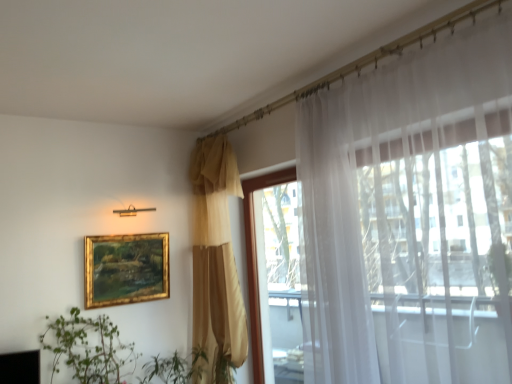
Question: Does matte gold curtain at center, arranged as the second curtain when viewed from the right, have a greater width compared to gold-framed painting at upper left?

Choices:
 (A) no
 (B) yes

Answer: (B)

Question: Is matte gold curtain at center, which is the 1th curtain in back-to-front order, facing away from gold-framed painting at upper left?

Choices:
 (A) yes
 (B) no

Answer: (B)

Question: Does matte gold curtain at center, which is the 2th curtain from front to back, have a lesser width compared to gold-framed painting at upper left?

Choices:
 (A) yes
 (B) no

Answer: (B)

Question: Is matte gold curtain at center, marked as the first curtain in a left-to-right arrangement, behind gold-framed painting at upper left?

Choices:
 (A) yes
 (B) no

Answer: (B)

Question: From a real-world perspective, is matte gold curtain at center, marked as the first curtain in a left-to-right arrangement, on gold-framed painting at upper left?

Choices:
 (A) no
 (B) yes

Answer: (B)

Question: Is white sheer curtain at right, which appears as the 2th curtain when viewed from the back, wider or thinner than green leafy plant at lower left?

Choices:
 (A) thin
 (B) wide

Answer: (A)

Question: From the image's perspective, is white sheer curtain at right, the 1th curtain from the front, above or below green leafy plant at lower left?

Choices:
 (A) above
 (B) below

Answer: (A)

Question: Visually, is white sheer curtain at right, which ranks as the first curtain in right-to-left order, positioned to the left or to the right of green leafy plant at lower left?

Choices:
 (A) right
 (B) left

Answer: (A)

Question: From their relative heights in the image, would you say white sheer curtain at right, which appears as the 2th curtain when viewed from the back, is taller or shorter than green leafy plant at lower left?

Choices:
 (A) tall
 (B) short

Answer: (A)

Question: Would you say transparent glass window at upper right is to the left or to the right of gold-framed painting at upper left in the picture?

Choices:
 (A) right
 (B) left

Answer: (A)

Question: In terms of height, does transparent glass window at upper right look taller or shorter compared to gold-framed painting at upper left?

Choices:
 (A) tall
 (B) short

Answer: (A)

Question: Is transparent glass window at upper right wider or thinner than gold-framed painting at upper left?

Choices:
 (A) thin
 (B) wide

Answer: (B)

Question: Is transparent glass window at upper right spatially inside gold-framed painting at upper left, or outside of it?

Choices:
 (A) inside
 (B) outside

Answer: (B)

Question: Considering their positions, is transparent glass window at upper right located in front of or behind green leafy plant at lower left?

Choices:
 (A) behind
 (B) front

Answer: (A)

Question: From a real-world perspective, is transparent glass window at upper right positioned above or below green leafy plant at lower left?

Choices:
 (A) below
 (B) above

Answer: (B)